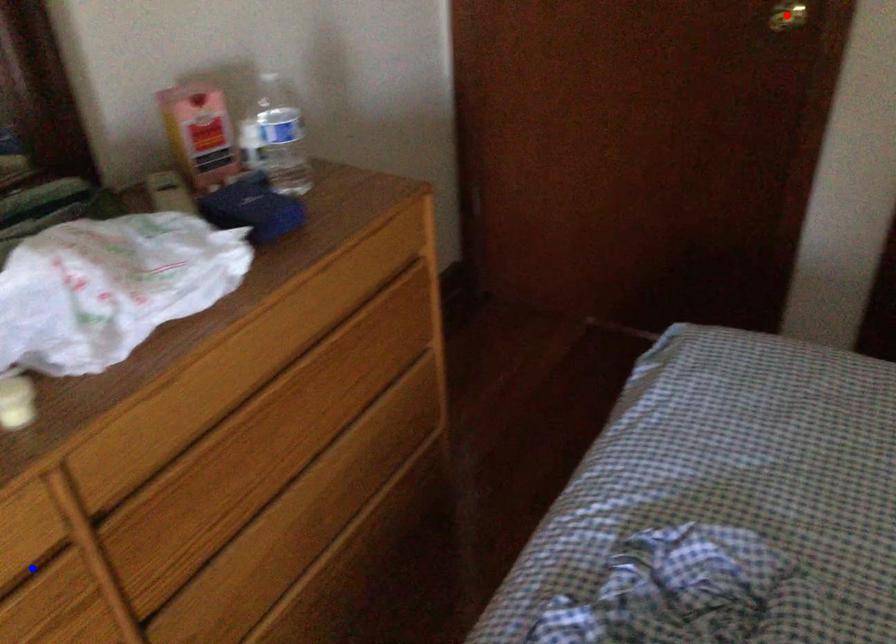
Question: In the image, two points are highlighted. Which point is nearer to the camera? Reply with the corresponding letter.

Choices:
 (A) blue point
 (B) red point

Answer: (A)